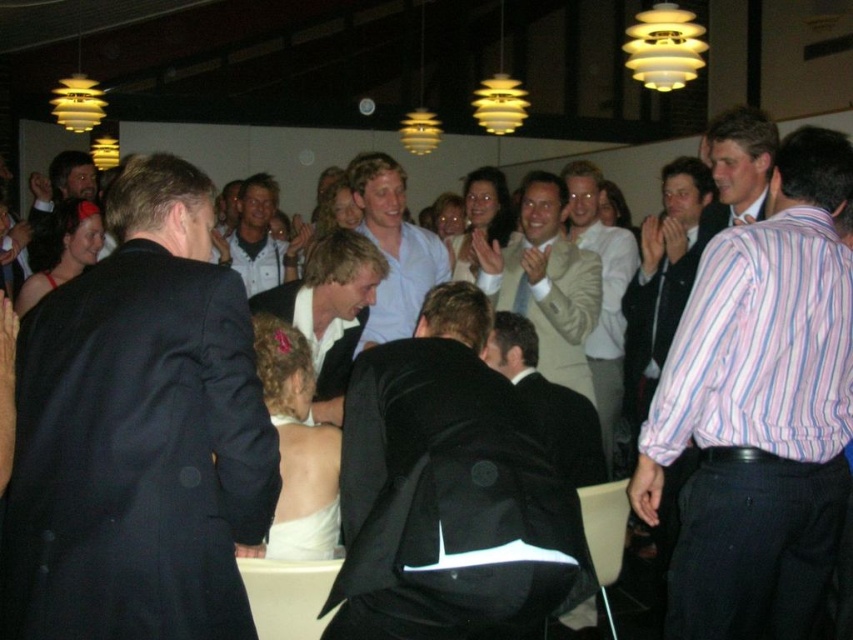
You are a photographer at this event and want to ensure both the pink striped shirt at center and the black suit at center are clearly visible in your photo. Given their sizes, which one might you need to position closer to the camera to maintain clarity?

The pink striped shirt at center is larger than the black suit at center, so positioning it slightly farther from the camera while keeping the black suit at center closer would help maintain clarity for both.

You are a photographer at this event and need to capture a group photo of the pink striped shirt at center and the black suit at center. The camera frame can only accommodate one of them fully. Which person should you focus on to ensure they fit within the frame?

The pink striped shirt at center has a larger width than the black suit at center, so focusing on the pink striped shirt at center ensures it will fit within the camera frame.

You are a photographer at the event and want to capture a photo of the light beige suit at center without any obstruction. Since the light blue shirt at center is in the way, can you move around to get a clear shot? Explain your reasoning.

The light blue shirt at center is behind the light beige suit at center, so moving around might allow you to position yourself where the light beige suit at center is in front without the light blue shirt at center obstructing the view.